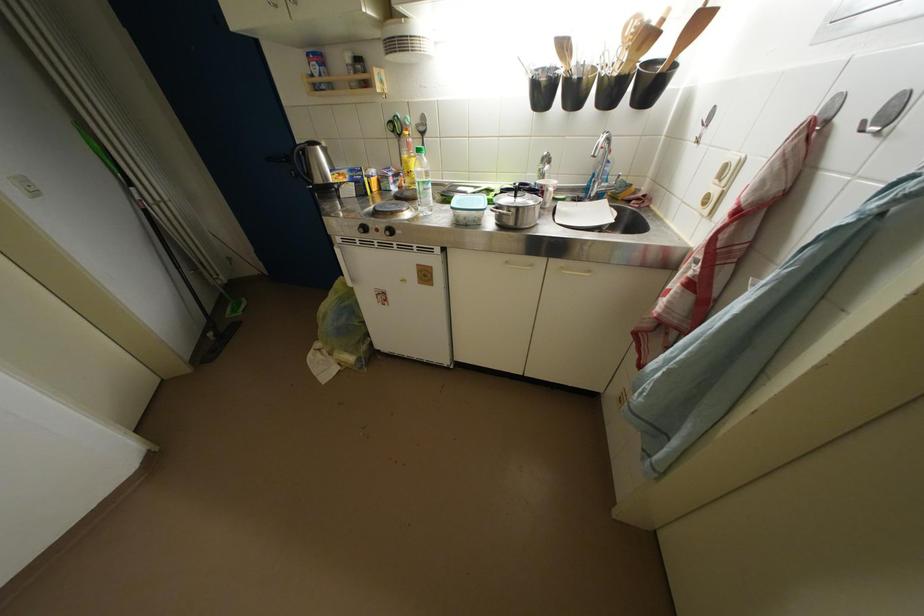
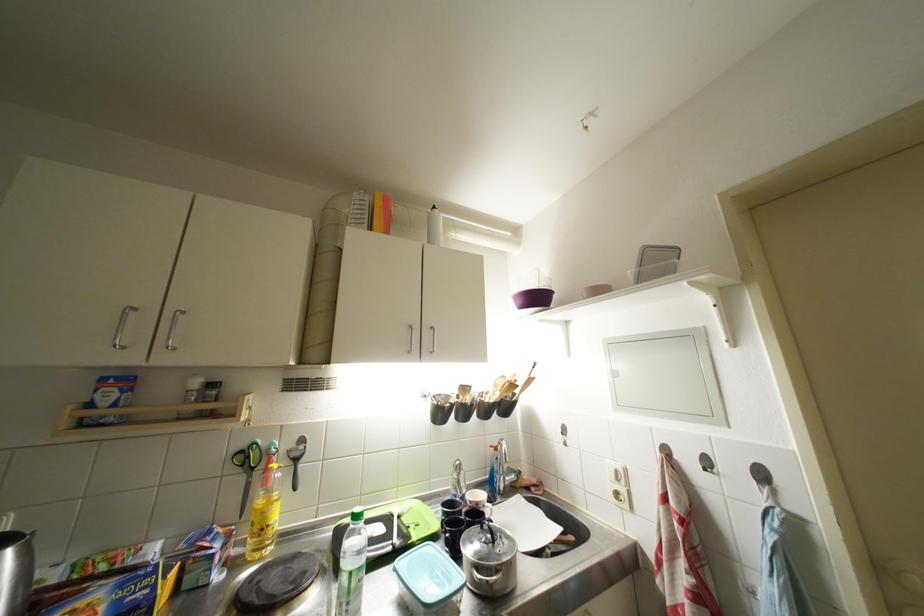
Find the pixel in the second image that matches [550,179] in the first image.

(466, 487)